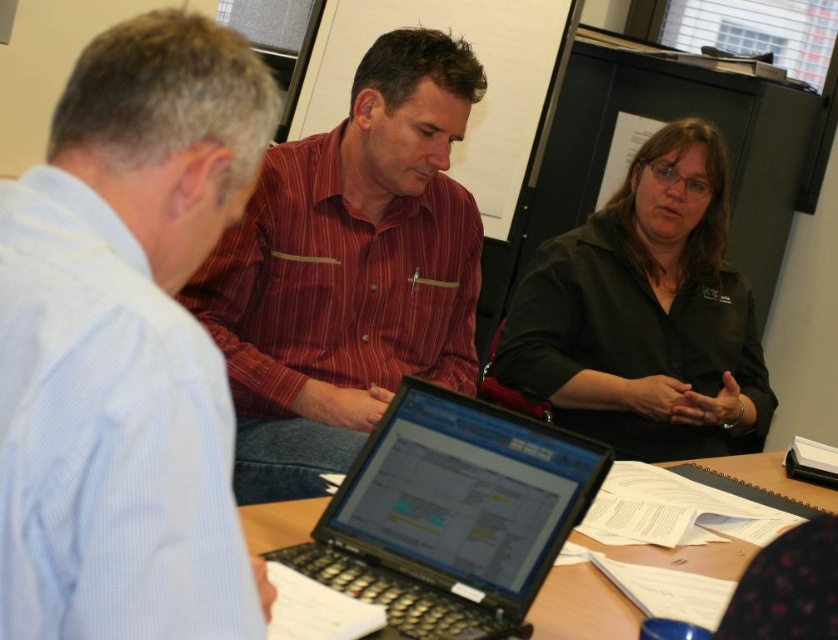
Question: Which object is the closest to the black button-down shirt at upper right?

Choices:
 (A) blue striped shirt at upper left
 (B) black plastic laptop at center
 (C) wooden table at center

Answer: (C)

Question: Is blue striped shirt at upper left positioned at the back of black plastic laptop at center?

Choices:
 (A) no
 (B) yes

Answer: (A)

Question: Which of these objects is positioned closest to the blue striped shirt at upper left?

Choices:
 (A) black button-down shirt at upper right
 (B) black plastic laptop at center
 (C) red striped shirt at center

Answer: (B)

Question: Does blue striped shirt at upper left come behind wooden table at center?

Choices:
 (A) no
 (B) yes

Answer: (A)

Question: Which object is positioned closest to the wooden table at center?

Choices:
 (A) red striped shirt at center
 (B) black plastic laptop at center
 (C) black button-down shirt at upper right
 (D) blue striped shirt at upper left

Answer: (C)

Question: Is blue striped shirt at upper left wider than wooden table at center?

Choices:
 (A) yes
 (B) no

Answer: (B)